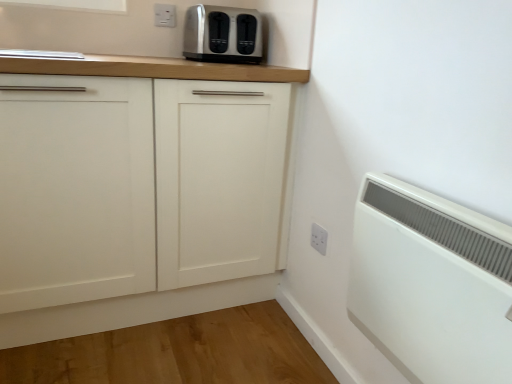
Question: In which direction should I rotate to look at white plastic electric outlet at upper center, the 1th electric outlet from the top?

Choices:
 (A) right
 (B) left

Answer: (B)

Question: Is white plastic radiator at lower right not close to white plastic electric outlet at upper center, arranged as the first electric outlet when viewed from the back?

Choices:
 (A) no
 (B) yes

Answer: (B)

Question: Considering the relative positions of white plastic radiator at lower right and white plastic electric outlet at upper center, the 1th electric outlet from the top, in the image provided, is white plastic radiator at lower right to the left of white plastic electric outlet at upper center, the 1th electric outlet from the top, from the viewer's perspective?

Choices:
 (A) yes
 (B) no

Answer: (B)

Question: Is white plastic radiator at lower right taller than white plastic electric outlet at upper center, the 1th electric outlet from the top?

Choices:
 (A) yes
 (B) no

Answer: (A)

Question: Is white plastic radiator at lower right facing towards white plastic electric outlet at upper center, the 2th electric outlet positioned from the front?

Choices:
 (A) no
 (B) yes

Answer: (A)

Question: Is white plastic radiator at lower right to the right of white plastic electric outlet at upper center, the 2th electric outlet positioned from the front, from the viewer's perspective?

Choices:
 (A) no
 (B) yes

Answer: (B)

Question: From the image's perspective, would you say white plastic radiator at lower right is positioned over white plastic electric outlet at upper center, the 2th electric outlet positioned from the front?

Choices:
 (A) yes
 (B) no

Answer: (B)

Question: From the image's perspective, is white matte cabinet at center under satin silver toaster at upper center?

Choices:
 (A) no
 (B) yes

Answer: (B)

Question: From a real-world perspective, is white matte cabinet at center under satin silver toaster at upper center?

Choices:
 (A) no
 (B) yes

Answer: (B)

Question: Can you confirm if white matte cabinet at center is thinner than satin silver toaster at upper center?

Choices:
 (A) no
 (B) yes

Answer: (A)

Question: Is white matte cabinet at center positioned with its back to satin silver toaster at upper center?

Choices:
 (A) no
 (B) yes

Answer: (A)

Question: From the image's perspective, would you say white matte cabinet at center is positioned over satin silver toaster at upper center?

Choices:
 (A) yes
 (B) no

Answer: (B)

Question: Does white matte cabinet at center appear on the left side of satin silver toaster at upper center?

Choices:
 (A) no
 (B) yes

Answer: (B)

Question: Considering the relative sizes of white matte cabinet at center and white plastic radiator at lower right in the image provided, is white matte cabinet at center shorter than white plastic radiator at lower right?

Choices:
 (A) yes
 (B) no

Answer: (B)